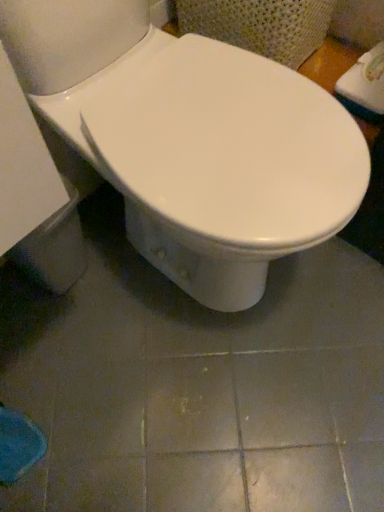
The image size is (384, 512). In order to click on white glossy bidet at center in this screenshot , I will do `click(226, 165)`.

The image size is (384, 512). What do you see at coordinates (226, 165) in the screenshot?
I see `white glossy bidet at center` at bounding box center [226, 165].

The width and height of the screenshot is (384, 512). Identify the location of white glossy bidet at center. (226, 165).